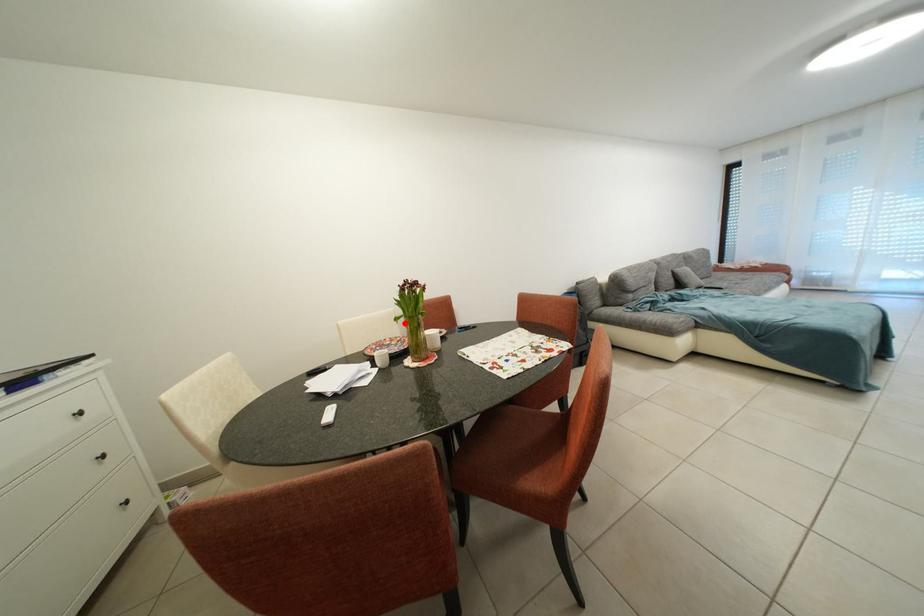
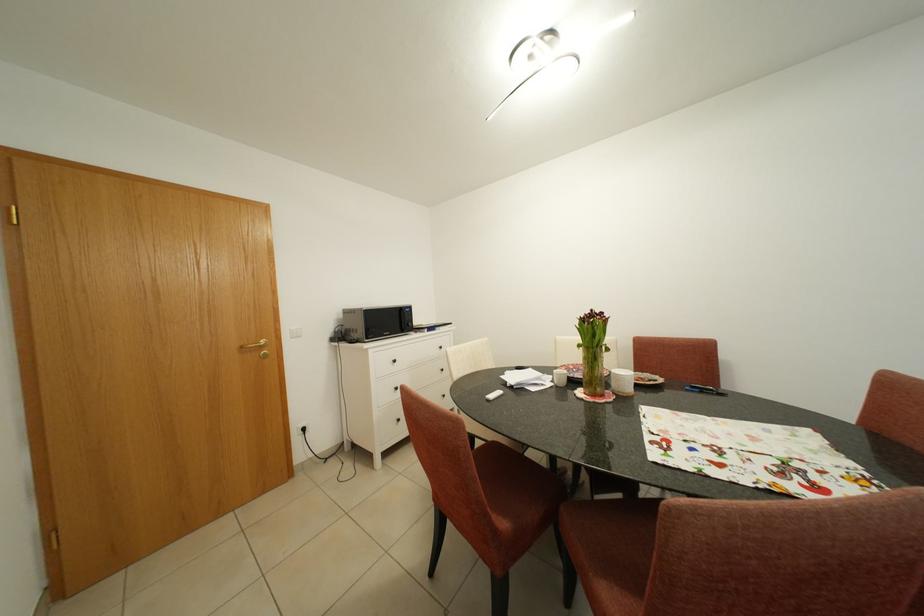
Locate, in the second image, the point that corresponds to the highlighted location in the first image.

(588, 350)